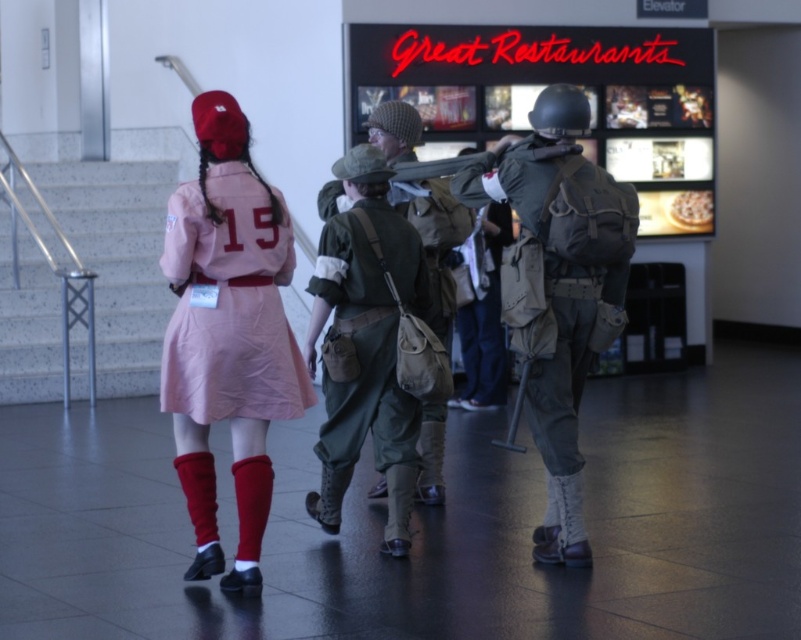
Question: Which point appears farthest from the camera in this image?

Choices:
 (A) (610, 337)
 (B) (433, 195)
 (C) (280, 362)

Answer: (B)

Question: Is pink fabric dress at center positioned at the back of camouflage fabric backpack at center?

Choices:
 (A) no
 (B) yes

Answer: (A)

Question: Which is farther from the camouflage fabric backpack at center?

Choices:
 (A) green canvas backpack at center
 (B) pink fabric dress at center

Answer: (B)

Question: From the image, what is the correct spatial relationship of pink fabric dress at center in relation to camouflage fabric backpack at center?

Choices:
 (A) left
 (B) right

Answer: (A)

Question: Based on their relative distances, which object is farther from the camouflage fabric backpack at center?

Choices:
 (A) pink fabric dress at center
 (B) green canvas backpack at center

Answer: (A)

Question: Can you confirm if pink fabric dress at center is thinner than camouflage fabric backpack at center?

Choices:
 (A) no
 (B) yes

Answer: (B)